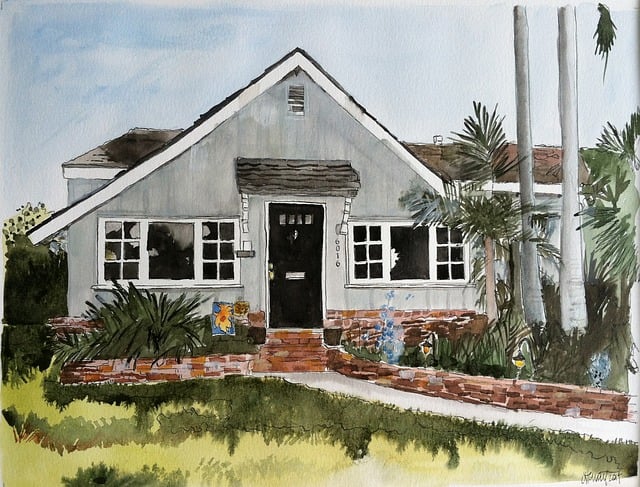
Locate an element on the screen. This screenshot has height=487, width=640. front door is located at coordinates (308, 263).